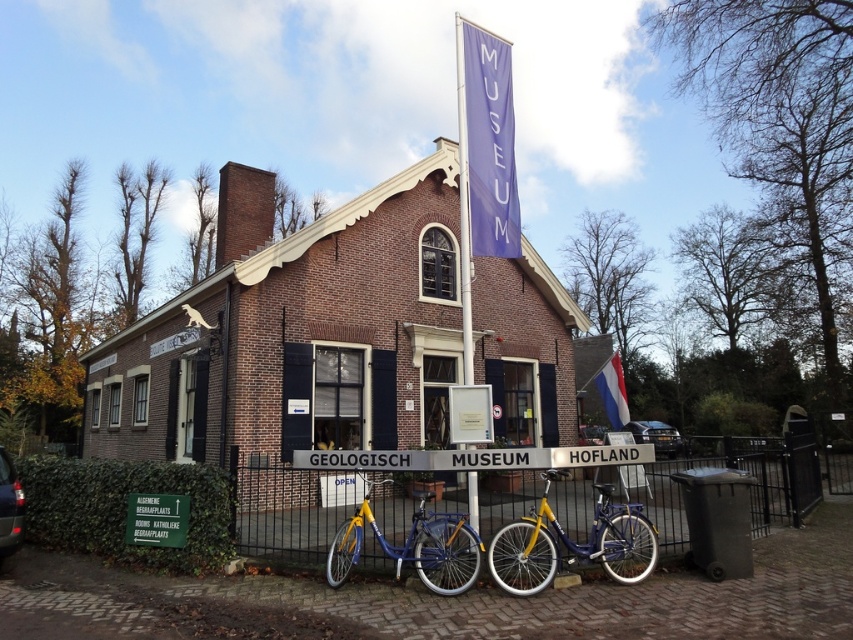
Question: Which object is positioned closest to the yellow matte bicycle at center?

Choices:
 (A) white fabric flag at right
 (B) blue matte bicycle at center
 (C) black metal fence at center

Answer: (B)

Question: Is shiny black car at lower left further to the viewer compared to white fabric flag at right?

Choices:
 (A) no
 (B) yes

Answer: (A)

Question: Among these objects, which one is farthest from the camera?

Choices:
 (A) shiny black car at lower left
 (B) metallic silver car at center
 (C) blue matte bicycle at center
 (D) yellow matte bicycle at center

Answer: (B)

Question: Which point appears closest to the camera in this image?

Choices:
 (A) (512, 257)
 (B) (471, 380)
 (C) (634, 420)
 (D) (619, 556)

Answer: (D)

Question: Does black metal fence at center come in front of white fabric flag at right?

Choices:
 (A) no
 (B) yes

Answer: (B)

Question: In this image, where is blue matte bicycle at center located relative to white fabric flag at right?

Choices:
 (A) above
 (B) below

Answer: (B)